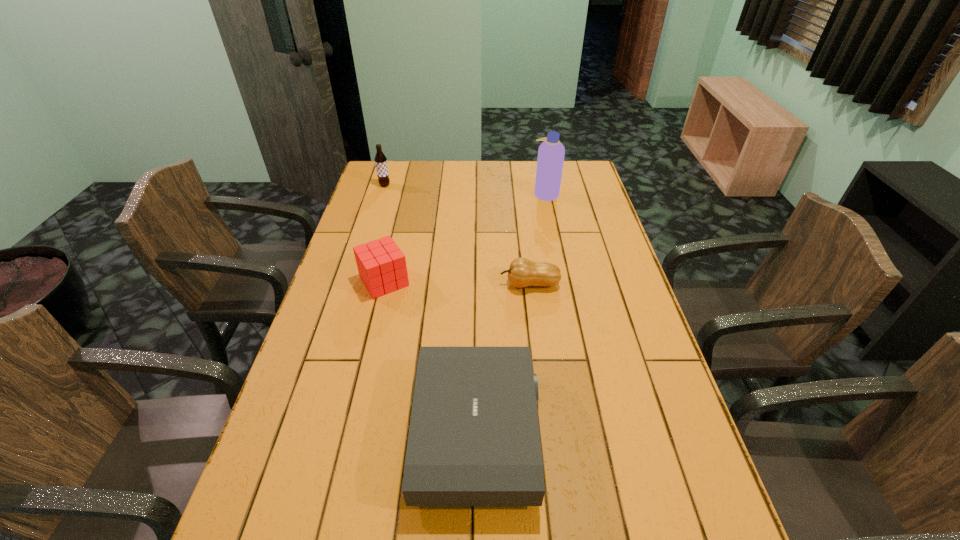
What are the coordinates of `free space between the tallest object and the cube` in the screenshot? It's located at (465, 238).

At what (x,y) coordinates should I click in order to perform the action: click on object that ranks as the third closest to the cube. Please return your answer as a coordinate pair (x, y). The width and height of the screenshot is (960, 540). Looking at the image, I should click on (380, 159).

Identify which object is located as the third nearest to the projector. Please provide its 2D coordinates. Your answer should be formatted as a tuple, i.e. [(x, y)], where the tuple contains the x and y coordinates of a point satisfying the conditions above.

[(551, 152)]

At what (x,y) coordinates should I click in order to perform the action: click on free point that satisfies the following two spatial constraints: 1. on the front side of the fourth shortest object; 2. on the right side of the shampoo. Please return your answer as a coordinate pair (x, y). Looking at the image, I should click on (382, 194).